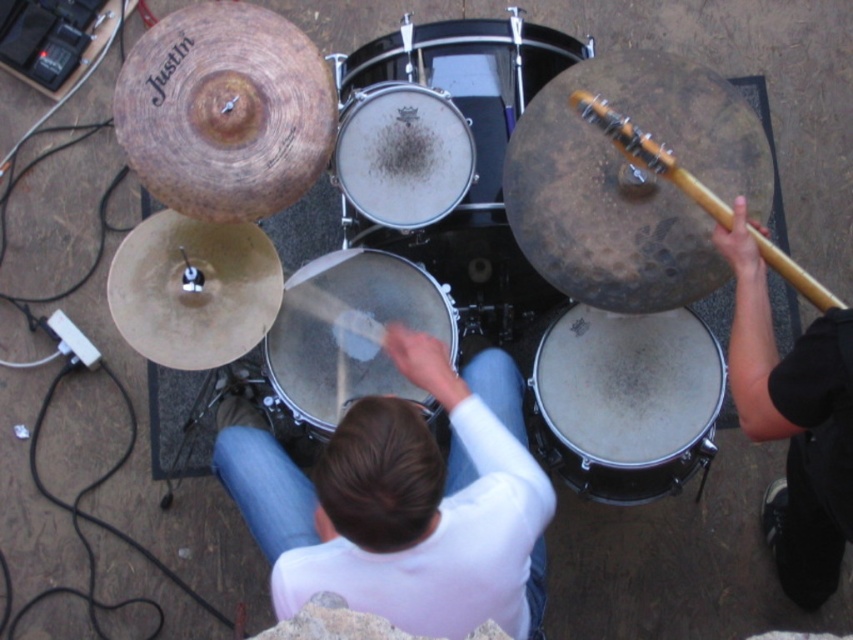
Question: Which object is closer to the camera taking this photo?

Choices:
 (A) white matte drum at lower right
 (B) wooden guitar neck at upper right
 (C) silver metallic drum at center
 (D) white matte shirt at center

Answer: (D)

Question: Does black fabric arm at right have a smaller size compared to smooth silver drum at center?

Choices:
 (A) no
 (B) yes

Answer: (A)

Question: Which of the following is the farthest from the observer?

Choices:
 (A) (515, 77)
 (B) (596, 100)

Answer: (A)

Question: In this image, where is white matte shirt at center located relative to black fabric arm at right?

Choices:
 (A) left
 (B) right

Answer: (A)

Question: Is black fabric arm at right above silver metallic drum at center?

Choices:
 (A) no
 (B) yes

Answer: (A)

Question: Which point is farther from the camera taking this photo?

Choices:
 (A) (663, 145)
 (B) (498, 179)
 (C) (375, 404)

Answer: (B)